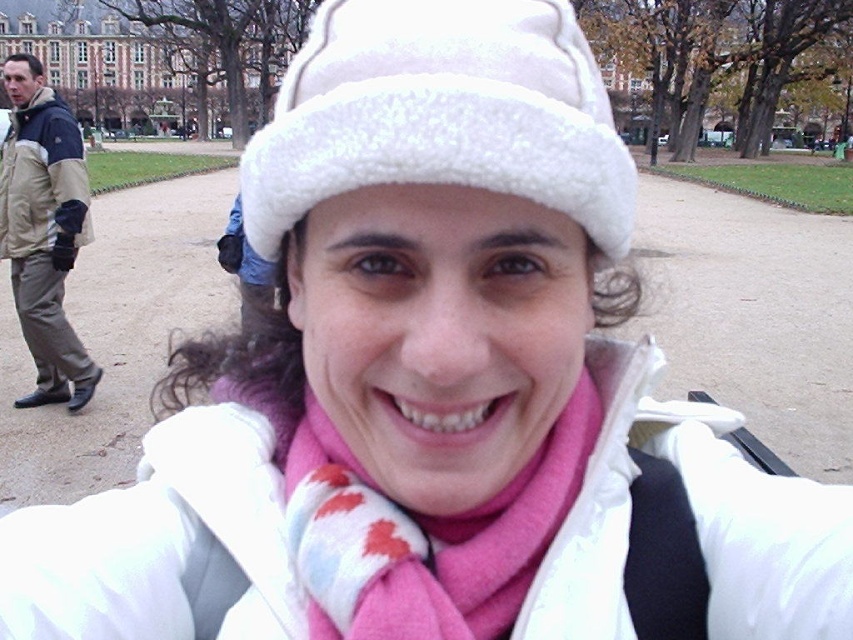
Question: Is khaki cotton pants at left to the left of khaki nylon jacket at left from the viewer's perspective?

Choices:
 (A) yes
 (B) no

Answer: (A)

Question: Among these objects, which one is farthest from the camera?

Choices:
 (A) white fuzzy hat at center
 (B) pink soft scarf at center

Answer: (B)

Question: Which object is closer to the camera taking this photo?

Choices:
 (A) pink soft scarf at center
 (B) khaki nylon jacket at left

Answer: (A)

Question: Is pink soft scarf at center positioned behind khaki nylon jacket at left?

Choices:
 (A) no
 (B) yes

Answer: (A)

Question: Which object is the farthest from the khaki nylon jacket at left?

Choices:
 (A) khaki cotton pants at left
 (B) white fuzzy hat at center
 (C) pink soft scarf at center

Answer: (C)

Question: Is khaki cotton pants at left behind khaki nylon jacket at left?

Choices:
 (A) no
 (B) yes

Answer: (B)